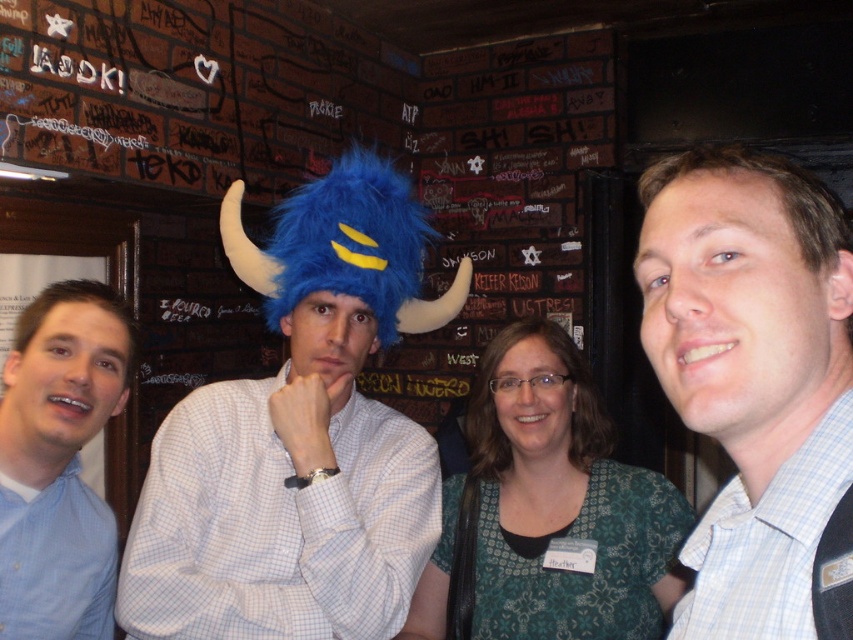
Question: Is the position of blue fuzzy hat at center more distant than that of blue fuzzy hat at left?

Choices:
 (A) yes
 (B) no

Answer: (A)

Question: Can you confirm if light blue checkered shirt at center is wider than blue fuzzy hat at left?

Choices:
 (A) no
 (B) yes

Answer: (A)

Question: Which of the following is the closest to the observer?

Choices:
 (A) light blue checkered shirt at center
 (B) blue fuzzy hat at center

Answer: (A)

Question: Which point appears farthest from the camera in this image?

Choices:
 (A) (44, 289)
 (B) (782, 166)
 (C) (337, 259)

Answer: (A)

Question: Is light blue checkered shirt at center closer to the viewer compared to blue fuzzy hat at left?

Choices:
 (A) no
 (B) yes

Answer: (B)

Question: Which of the following is the closest to the observer?

Choices:
 (A) blue fuzzy hat at center
 (B) blue fuzzy hat at left

Answer: (B)